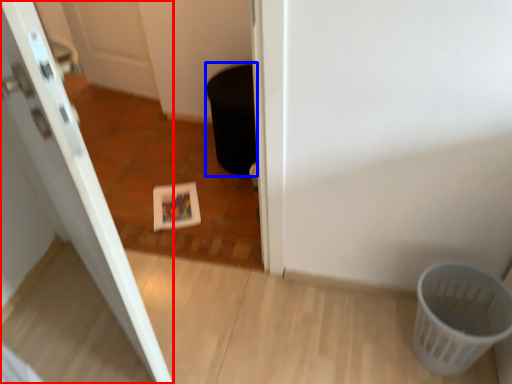
Question: Which object appears closest to the camera in this image, door (highlighted by a red box) or potty (highlighted by a blue box)?

Choices:
 (A) door
 (B) potty

Answer: (A)